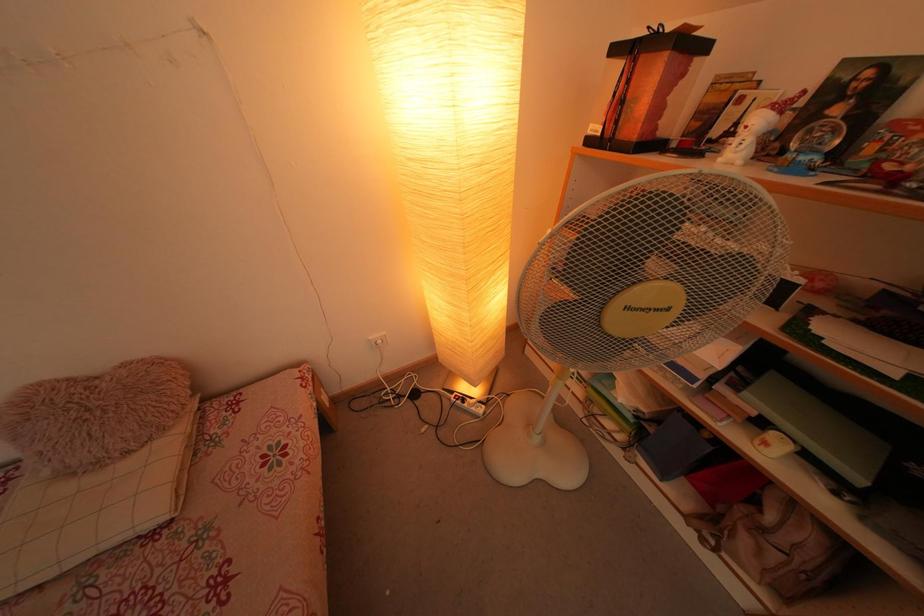
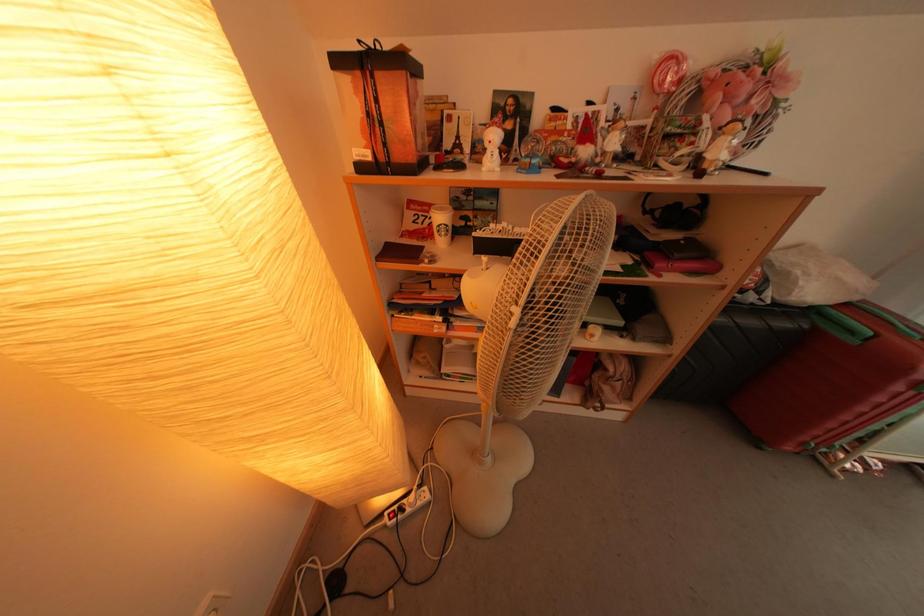
Question: The camera is either moving clockwise (left) or counter-clockwise (right) around the object. The first image is from the beginning of the video and the second image is from the end. Is the camera moving left or right when shooting the video?

Choices:
 (A) Left
 (B) Right

Answer: (A)